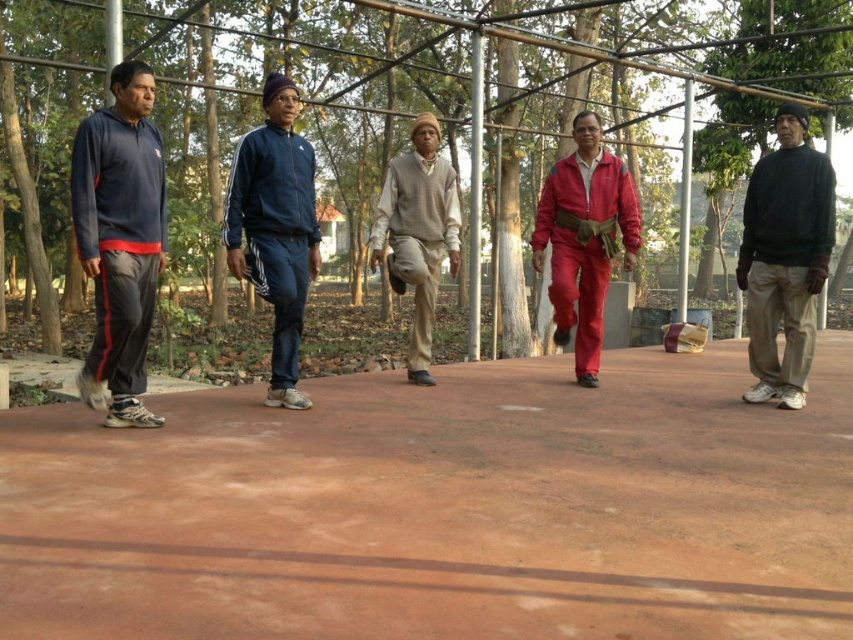
Question: Which object is the closest to the dark blue track suit at left?

Choices:
 (A) red matte jumpsuit at center
 (B) brown concrete path at center

Answer: (B)

Question: From the image, what is the correct spatial relationship of brown concrete path at center in relation to dark blue track suit at left?

Choices:
 (A) right
 (B) left

Answer: (A)

Question: Does dark blue track suit at left have a smaller size compared to blue track suit at center?

Choices:
 (A) yes
 (B) no

Answer: (A)

Question: Among these objects, which one is farthest from the camera?

Choices:
 (A) light beige sweater at center
 (B) dark gray sweater at right

Answer: (A)

Question: Observing the image, what is the correct spatial positioning of dark gray sweater at right in reference to blue track suit at center?

Choices:
 (A) below
 (B) above

Answer: (A)

Question: Which of these objects is positioned farthest from the red matte jumpsuit at center?

Choices:
 (A) dark gray sweater at right
 (B) blue track suit at center
 (C) brown concrete path at center
 (D) light beige sweater at center

Answer: (B)